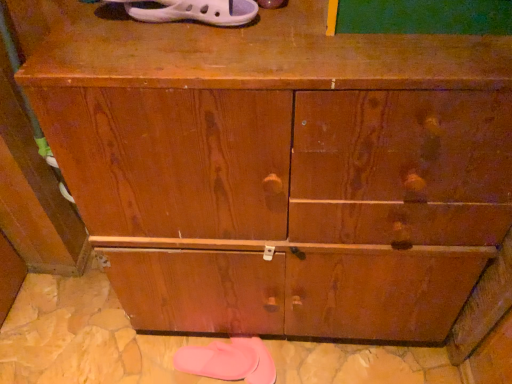
Where is `free space in front of white rubber sandal at upper center, the 2th footwear in the bottom-to-top sequence`? free space in front of white rubber sandal at upper center, the 2th footwear in the bottom-to-top sequence is located at coordinates (189, 56).